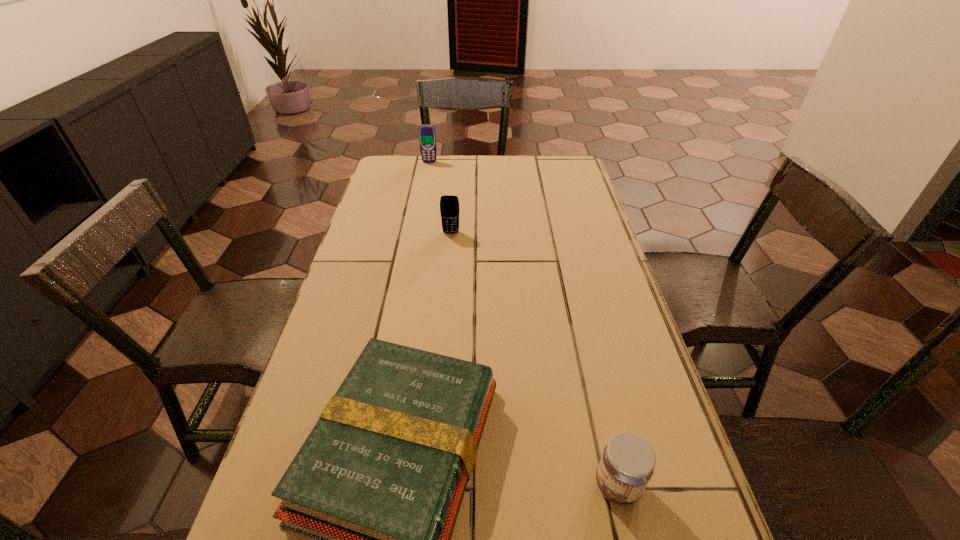
At what (x,y) coordinates should I click in order to perform the action: click on object located at the far edge. Please return your answer as a coordinate pair (x, y). Looking at the image, I should click on (427, 137).

The image size is (960, 540). I want to click on object that is positioned at the left edge, so click(427, 137).

The width and height of the screenshot is (960, 540). I want to click on object that is at the right edge, so click(x=627, y=464).

Where is `object situated at the far left corner`? object situated at the far left corner is located at coordinates (427, 137).

Find the location of `free location at the far edge of the desktop`. free location at the far edge of the desktop is located at coordinates (488, 177).

Where is `vacant space at the left edge`? The image size is (960, 540). vacant space at the left edge is located at coordinates (346, 262).

Identify the location of vacant space at the right edge of the desktop. The height and width of the screenshot is (540, 960). (589, 288).

Where is `free point at the far left corner`? This screenshot has width=960, height=540. free point at the far left corner is located at coordinates (396, 157).

The height and width of the screenshot is (540, 960). In order to click on vacant space at the far right corner of the desktop in this screenshot , I will do pos(539,158).

You are a GUI agent. You are given a task and a screenshot of the screen. Output one action in this format:
    pyautogui.click(x=<x>, y=<y>)
    Task: Click on the free spot between the rightmost object and the second farthest object
    
    Given the screenshot: What is the action you would take?
    pyautogui.click(x=534, y=359)